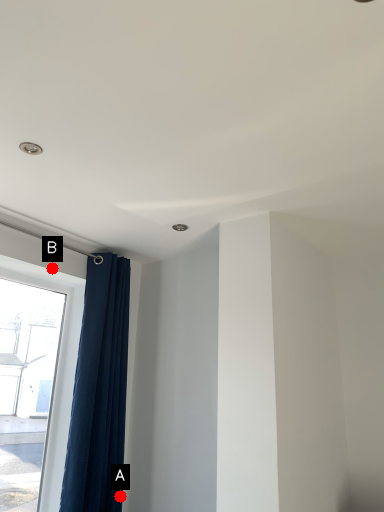
Question: Two points are circled on the image, labeled by A and B beside each circle. Which point appears farthest from the camera in this image?

Choices:
 (A) A is further
 (B) B is further

Answer: (B)